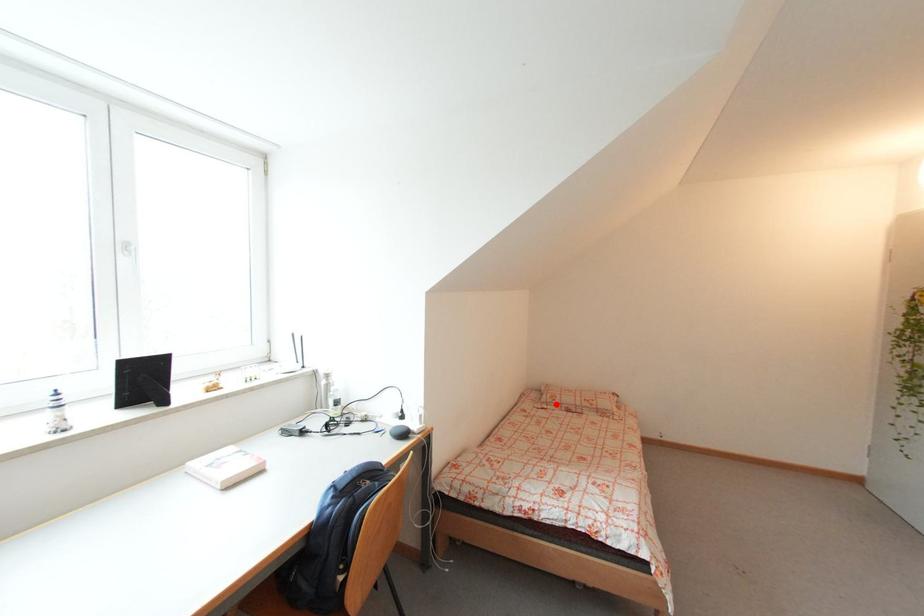
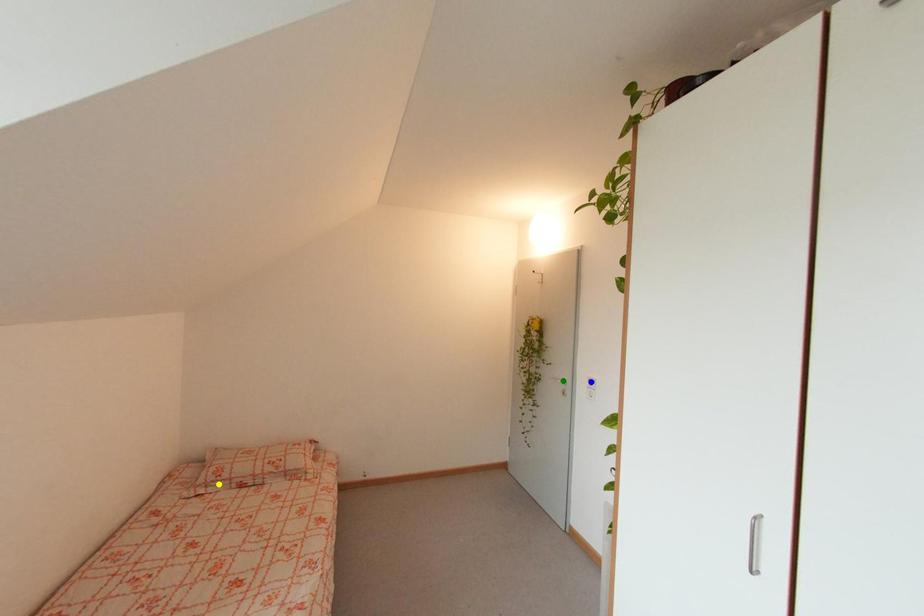
Question: I am providing you with two images of the same scene from different viewpoints. A red point is marked on the first image. You are given multiple points on the second image. Can you choose the point in image 2 that corresponds to the point in image 1?

Choices:
 (A) yellow point
 (B) blue point
 (C) green point

Answer: (A)